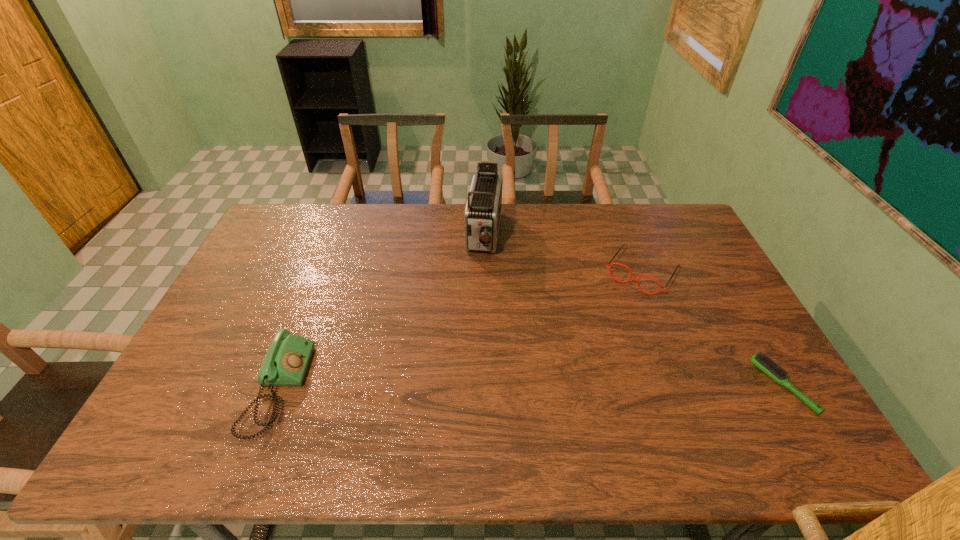
I want to click on vacant position located on the front-facing side of the third tallest object, so click(620, 303).

Where is `free space located on the front-facing side of the third tallest object`? This screenshot has width=960, height=540. free space located on the front-facing side of the third tallest object is located at coordinates (607, 323).

Identify the location of free space located on the front-facing side of the third tallest object. (568, 380).

You are a GUI agent. You are given a task and a screenshot of the screen. Output one action in this format:
    pyautogui.click(x=<x>, y=<y>)
    Task: Click on the vacant position located at the lens of the tallest object
    
    Given the screenshot: What is the action you would take?
    pyautogui.click(x=467, y=359)

Find the location of a particular element. vacant space located 0.180m at the lens of the tallest object is located at coordinates (476, 303).

The image size is (960, 540). I want to click on free space located at the lens of the tallest object, so click(x=474, y=313).

Find the location of a particular element. This screenshot has height=540, width=960. object that is at the far edge is located at coordinates (482, 213).

Locate an element on the screen. Image resolution: width=960 pixels, height=540 pixels. telephone that is at the near edge is located at coordinates (285, 364).

Identify the location of hairbrush that is at the near edge. (763, 362).

This screenshot has width=960, height=540. I want to click on hairbrush that is at the right edge, so click(x=763, y=362).